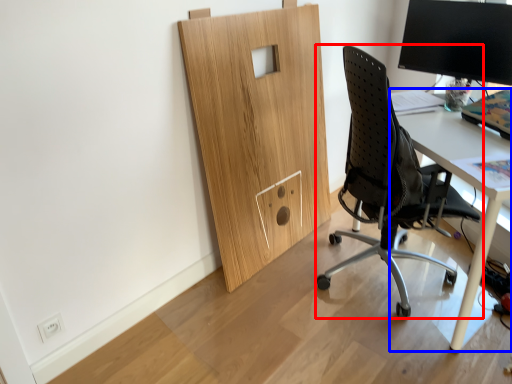
Question: Which object is further to the camera taking this photo, chair (highlighted by a red box) or desk (highlighted by a blue box)?

Choices:
 (A) chair
 (B) desk

Answer: (B)